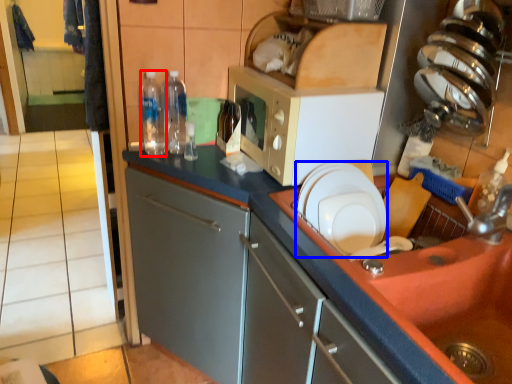
Question: Which of the following is the farthest to the observer, bottle (highlighted by a red box) or plate (highlighted by a blue box)?

Choices:
 (A) bottle
 (B) plate

Answer: (A)